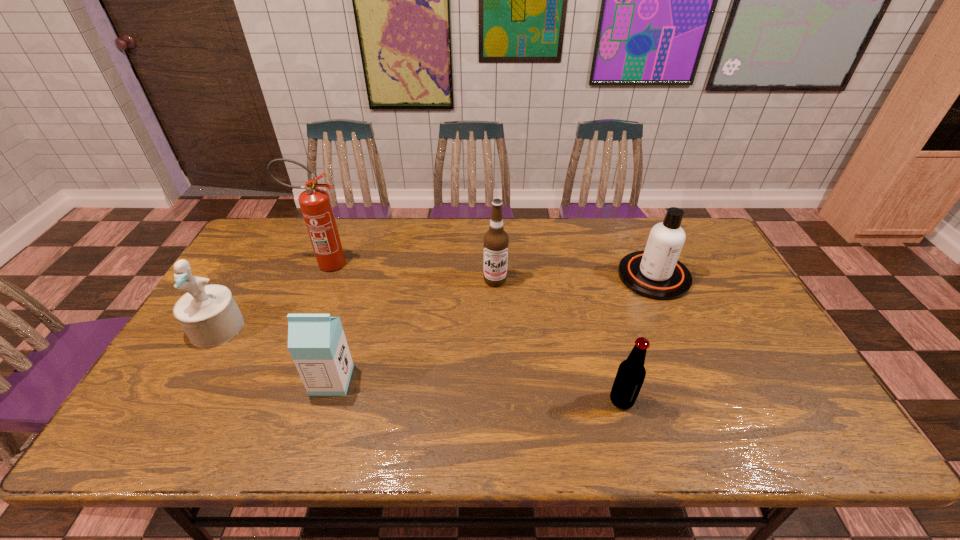
This screenshot has width=960, height=540. I want to click on the fifth object from right to left, so click(x=315, y=204).

The width and height of the screenshot is (960, 540). I want to click on the tallest object, so click(x=315, y=204).

Where is `the third object from right to left`? the third object from right to left is located at coordinates (496, 240).

The image size is (960, 540). In order to click on the second tallest object in this screenshot , I will do (496, 240).

The image size is (960, 540). I want to click on figurine, so click(x=208, y=314).

I want to click on the third nearest object, so point(208,314).

You are a GUI agent. You are given a task and a screenshot of the screen. Output one action in this format:
    pyautogui.click(x=<x>, y=<y>)
    Task: Click on the rightmost object
    
    Given the screenshot: What is the action you would take?
    pyautogui.click(x=656, y=273)

Find the location of `milk carton`. milk carton is located at coordinates (317, 343).

Identify the location of beer bottle. (631, 373).

I want to click on free space located 0.370m from the nozzle of the fire extinguisher, so click(x=466, y=264).